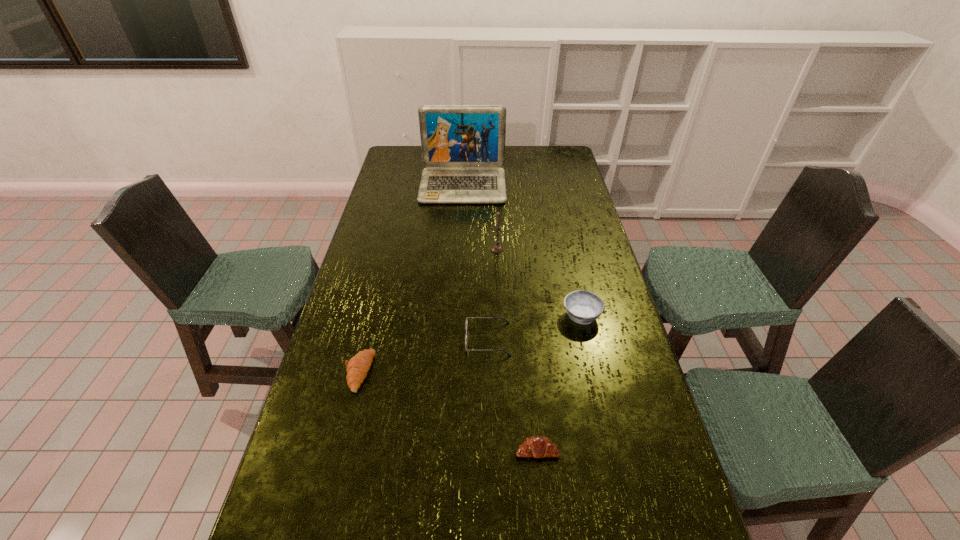
This screenshot has height=540, width=960. In order to click on the nearest object in this screenshot , I will do `click(536, 446)`.

Find the location of `vacant area situated on the screen of the laptop computer`. vacant area situated on the screen of the laptop computer is located at coordinates (460, 245).

Locate an element on the screen. free region located 0.140m on the front of the fifth nearest object is located at coordinates (498, 278).

Locate an element on the screen. The height and width of the screenshot is (540, 960). free point located 0.210m on the front of the rightmost object is located at coordinates (598, 388).

Locate an element on the screen. This screenshot has width=960, height=540. free space located on the front-facing side of the sunglasses is located at coordinates (388, 339).

Locate an element on the screen. Image resolution: width=960 pixels, height=540 pixels. vacant space located 0.260m on the front-facing side of the sunglasses is located at coordinates (381, 339).

In order to click on free space located 0.070m on the front-facing side of the sunglasses in this screenshot , I will do `click(443, 339)`.

What are the coordinates of `vacant space situated on the front of the farther crescent roll` in the screenshot? It's located at (343, 438).

The height and width of the screenshot is (540, 960). Find the location of `vacant area located on the left of the shortest object`. vacant area located on the left of the shortest object is located at coordinates 403,450.

Locate an element on the screen. object located in the left edge section of the desktop is located at coordinates (357, 368).